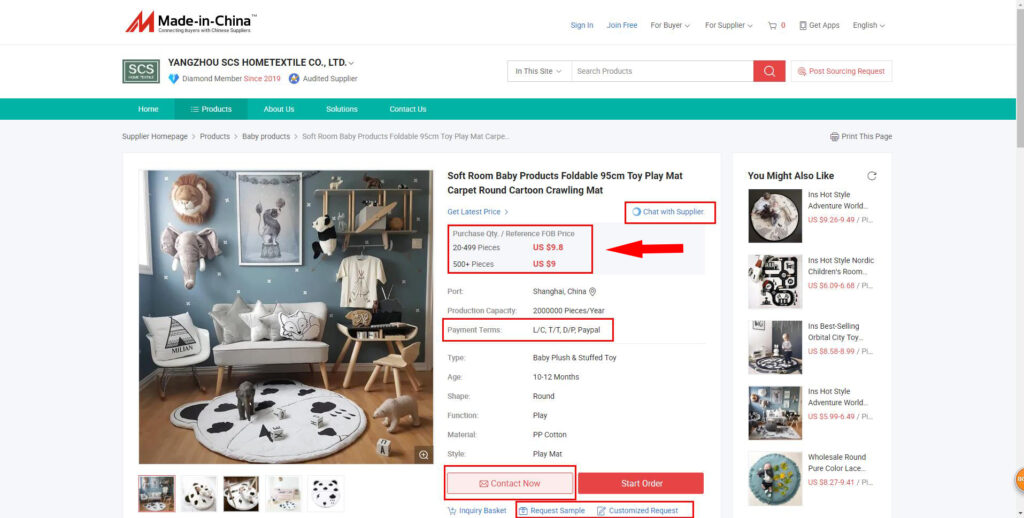
What are the coordinates of `toys` in the screenshot? It's located at (400, 408), (383, 444), (275, 431), (275, 407), (241, 397), (319, 422).